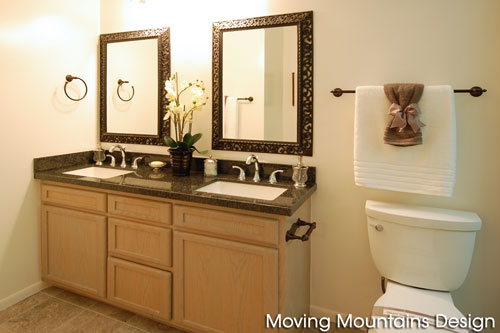
Image resolution: width=500 pixels, height=333 pixels. I want to click on towel ring, so click(x=73, y=96).